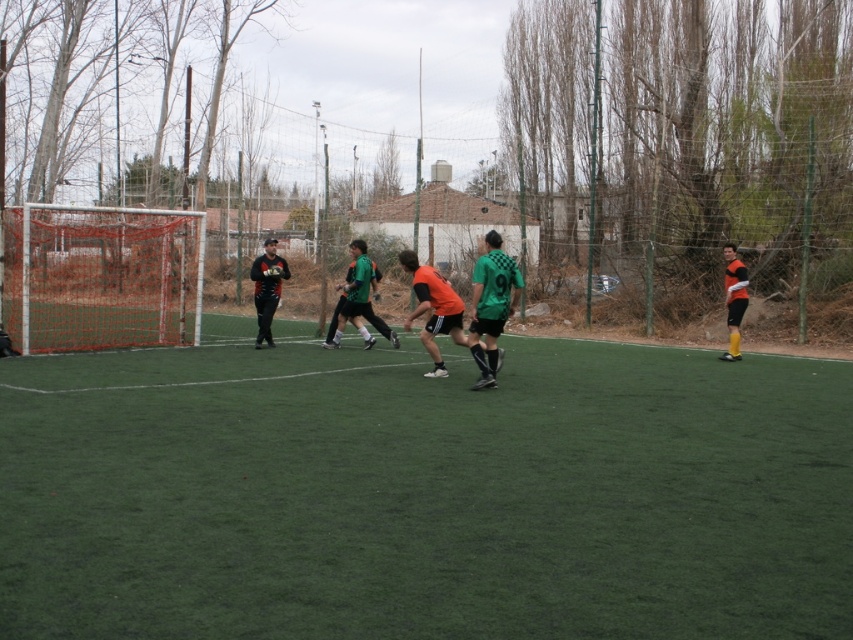
Based on the photo, you are a soccer coach standing on the sideline of the field. You want to give instructions to the player in the orange matte jersey at center. Considering the distance between you and the player, can you shout your instructions clearly without needing a megaphone?

The distance between you and the orange matte jersey at center is 11.59 meters. Since shouting can typically be heard up to 20 meters with effort, you can likely shout instructions clearly without needing a megaphone.